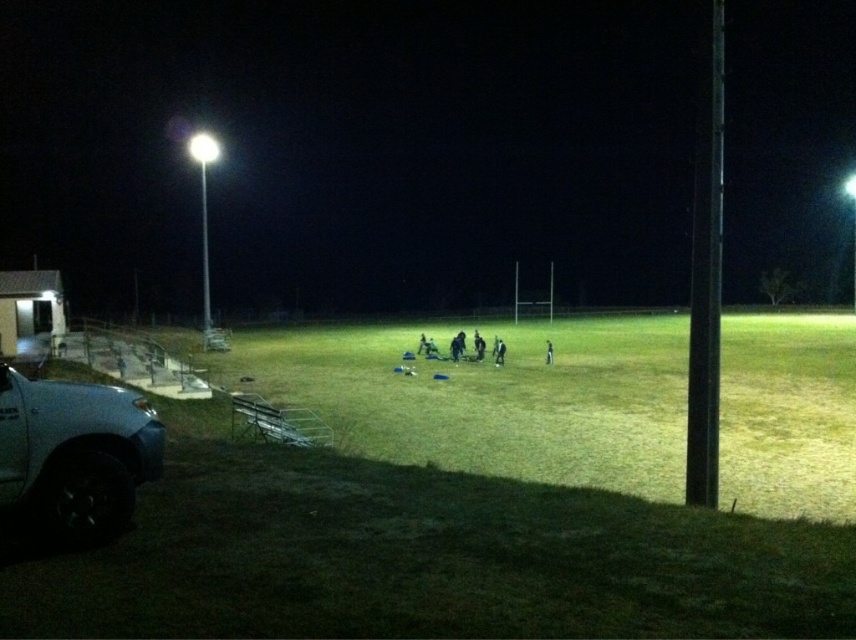
Question: Is green grass at center thinner than silver metallic truck at lower left?

Choices:
 (A) no
 (B) yes

Answer: (A)

Question: Can you confirm if silver metallic truck at lower left is positioned above black fabric person at center?

Choices:
 (A) no
 (B) yes

Answer: (B)

Question: Which object appears farthest from the camera in this image?

Choices:
 (A) green grass at center
 (B) silver metallic truck at lower left
 (C) green grass football field at center

Answer: (C)

Question: Which point is farther from the camera taking this photo?

Choices:
 (A) (60, 458)
 (B) (747, 35)

Answer: (B)

Question: Which of the following is the closest to the observer?

Choices:
 (A) tap(601, 385)
 (B) tap(22, 420)
 (C) tap(551, 355)
 (D) tap(337, 115)

Answer: (B)

Question: Is green grass at center to the right of green grass football field at center from the viewer's perspective?

Choices:
 (A) yes
 (B) no

Answer: (A)